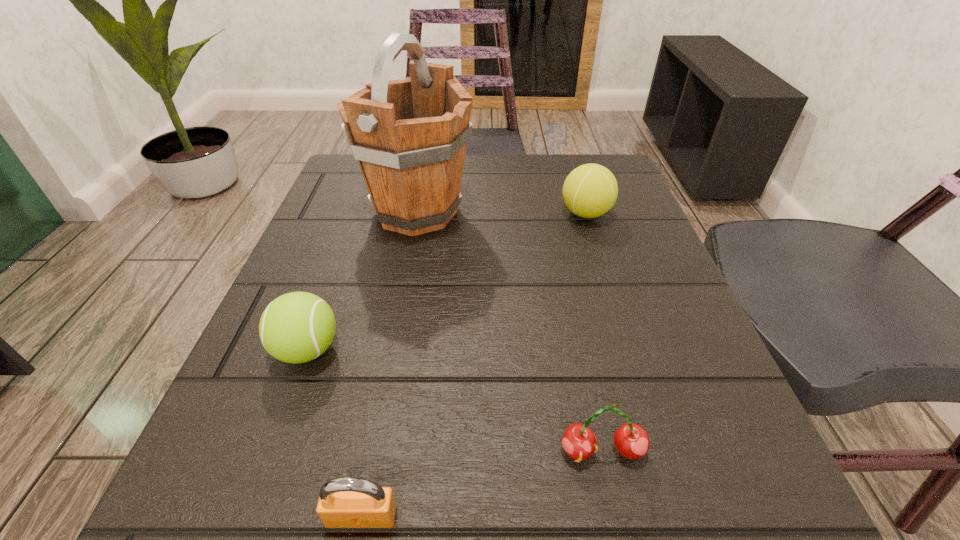
The width and height of the screenshot is (960, 540). In order to click on object that ranks as the closest to the shortest object in this screenshot , I will do `click(297, 327)`.